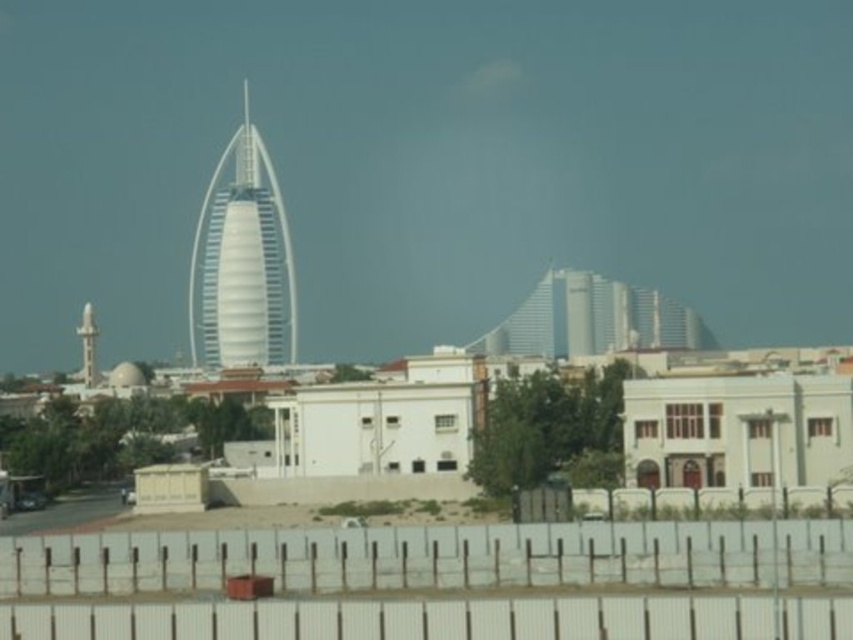
Looking at this image, you are a drone operator tasked with flying a drone from the white plastic fence at lower center to the white glossy minaret at upper left. The drone has a maximum flight range of 200 meters. Can the drone reach the minaret without needing to recharge?

The white plastic fence at lower center is 189.75 meters from the white glossy minaret at upper left. Since the drone can fly up to 200 meters, it can reach the minaret without needing to recharge.

You are a city planner evaluating the construction site. The white plastic fence at lower center needs to be replaced with a new fence that is exactly the same width as the white glossy minaret at upper left. Can you confirm if the current fence is wider than the minaret?

The white plastic fence at lower center might be wider than white glossy minaret at upper left, so it is uncertain whether the current fence is wider. Further measurement is needed to confirm the exact dimensions before deciding on the replacement fence width.

You are a drone operator planning to fly a drone over the cityscape shown in the image. The drone has a maximum flight altitude of 100 meters. Considering the white plastic fence at lower center is located at the starting point, will the drone be able to fly over the tallest skyscraper in the background without exceeding its altitude limit?

The distance of white plastic fence at lower center from viewer is 92.56 meters. Since the drone can fly up to 100 meters, it can safely fly over the tallest skyscraper in the background without exceeding its altitude limit.